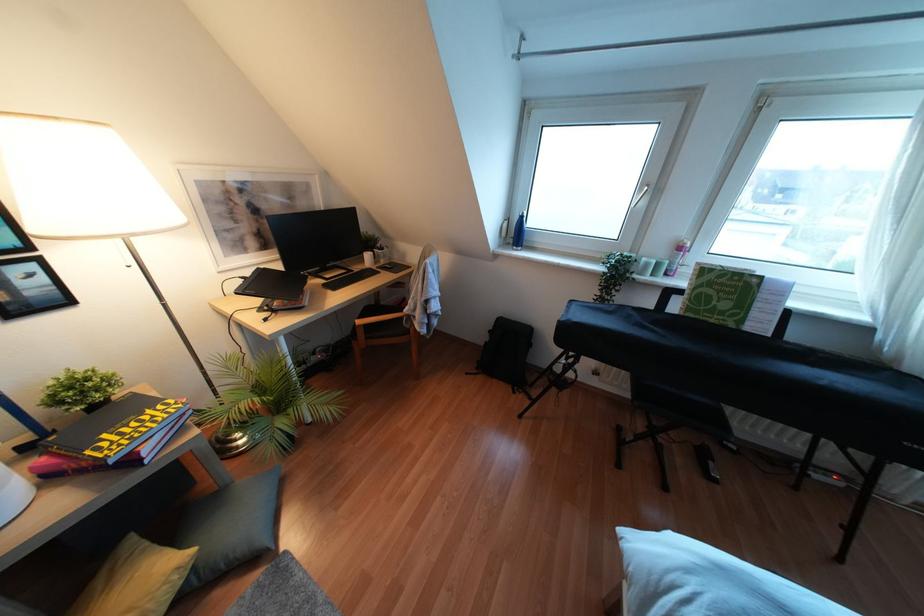
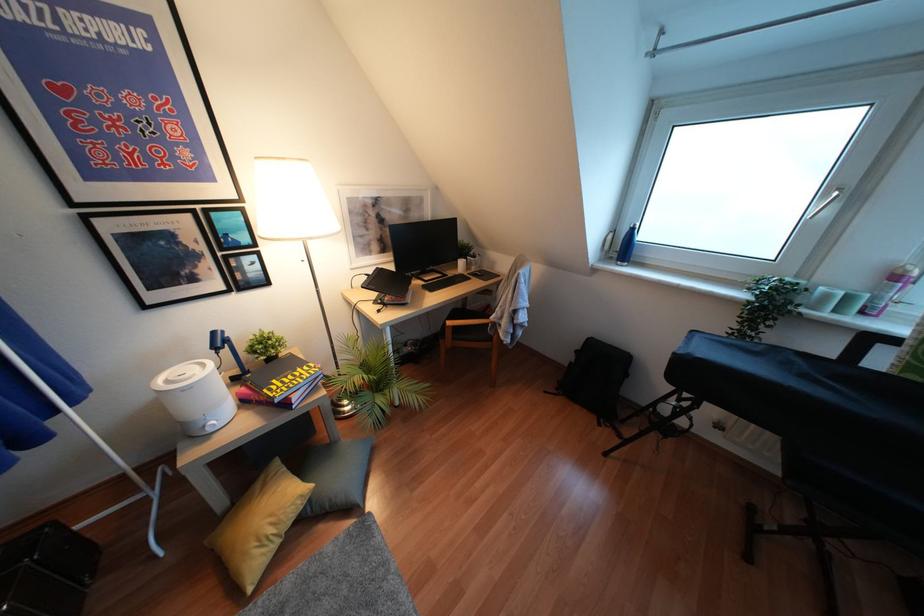
The point at (x=489, y=331) is marked in the first image. Where is the corresponding point in the second image?

(575, 351)